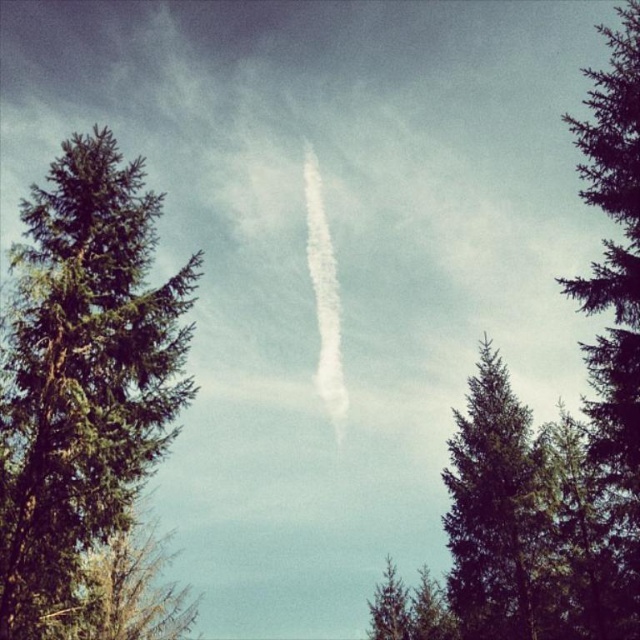
Question: Is green textured tree at left thinner than green textured tree at center?

Choices:
 (A) no
 (B) yes

Answer: (A)

Question: Which point is closer to the camera taking this photo?

Choices:
 (A) (474, 573)
 (B) (52, 248)
 (C) (616, 61)

Answer: (B)

Question: Based on their relative distances, which object is farther from the green textured tree at left?

Choices:
 (A) green textured tree at center
 (B) green textured pine tree at center

Answer: (B)

Question: Which point is closer to the camera?

Choices:
 (A) green textured pine tree at center
 (B) green textured tree at left

Answer: (B)

Question: Does green textured tree at left appear on the right side of green textured tree at center?

Choices:
 (A) yes
 (B) no

Answer: (B)

Question: Where is green textured tree at left located in relation to green textured tree at center in the image?

Choices:
 (A) below
 (B) above

Answer: (B)